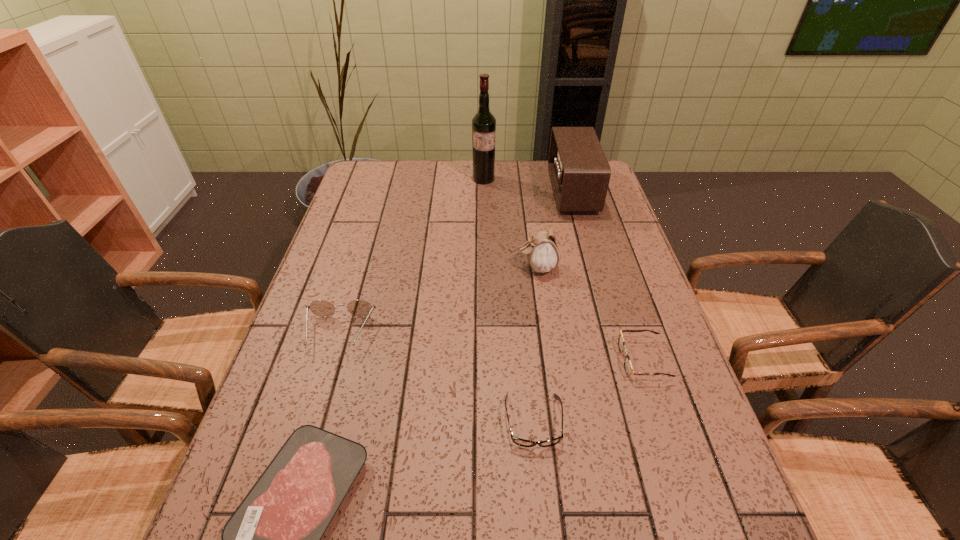
I want to click on wine bottle present at the far edge, so click(x=483, y=123).

This screenshot has height=540, width=960. What are the coordinates of `radio receiver present at the far edge` in the screenshot? It's located at (580, 173).

Where is `object present at the left edge`? Image resolution: width=960 pixels, height=540 pixels. object present at the left edge is located at coordinates (322, 308).

At what (x,y) coordinates should I click in order to perform the action: click on radio receiver positioned at the right edge. Please return your answer as a coordinate pair (x, y). Looking at the image, I should click on (580, 173).

Locate an element on the screen. Image resolution: width=960 pixels, height=540 pixels. spectacles present at the right edge is located at coordinates (628, 367).

Find the location of `object that is positioned at the far right corner`. object that is positioned at the far right corner is located at coordinates (580, 173).

The width and height of the screenshot is (960, 540). In the image, there is a desktop. What are the coordinates of `vacant area at the far edge` in the screenshot? It's located at (478, 186).

This screenshot has height=540, width=960. In the image, there is a desktop. In order to click on vacant space at the left edge in this screenshot , I will do pos(369,233).

In the image, there is a desktop. Where is `free space at the right edge`? This screenshot has height=540, width=960. free space at the right edge is located at coordinates (677, 377).

Find the location of a particular element. vacant space at the far left corner is located at coordinates (391, 175).